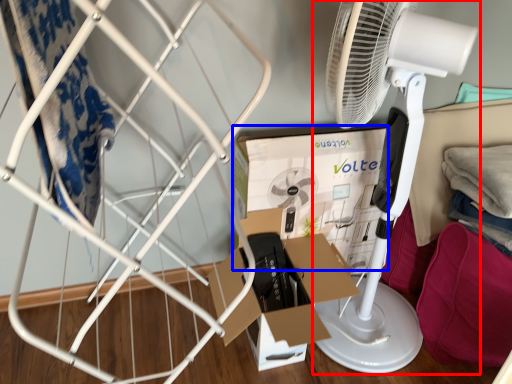
Question: Which of the following is the farthest to the observer, mechanical fan (highlighted by a red box) or box (highlighted by a blue box)?

Choices:
 (A) mechanical fan
 (B) box

Answer: (B)